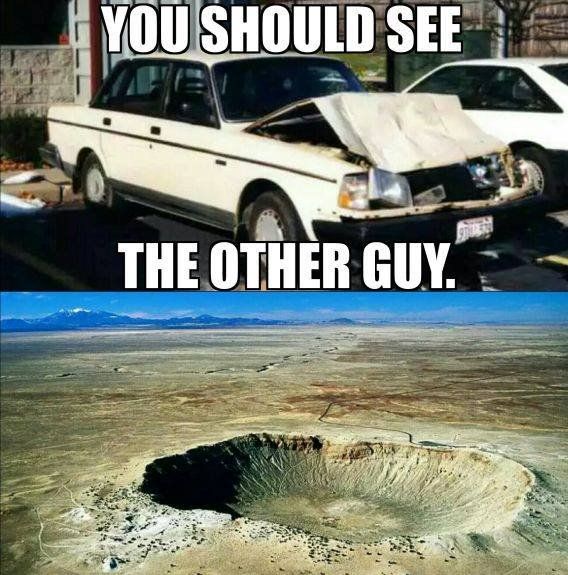
What are the coordinates of `wall` in the screenshot? It's located at (45, 75).